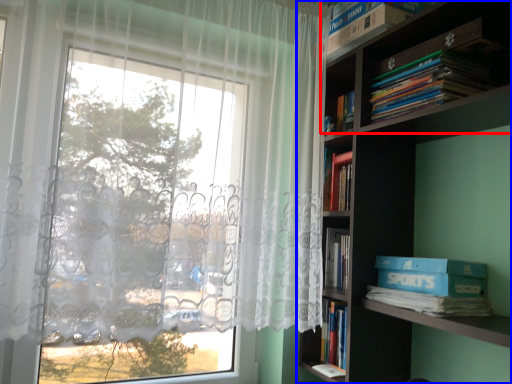
Question: Among these objects, which one is nearest to the camera, shelf (highlighted by a red box) or bookcase (highlighted by a blue box)?

Choices:
 (A) shelf
 (B) bookcase

Answer: (B)